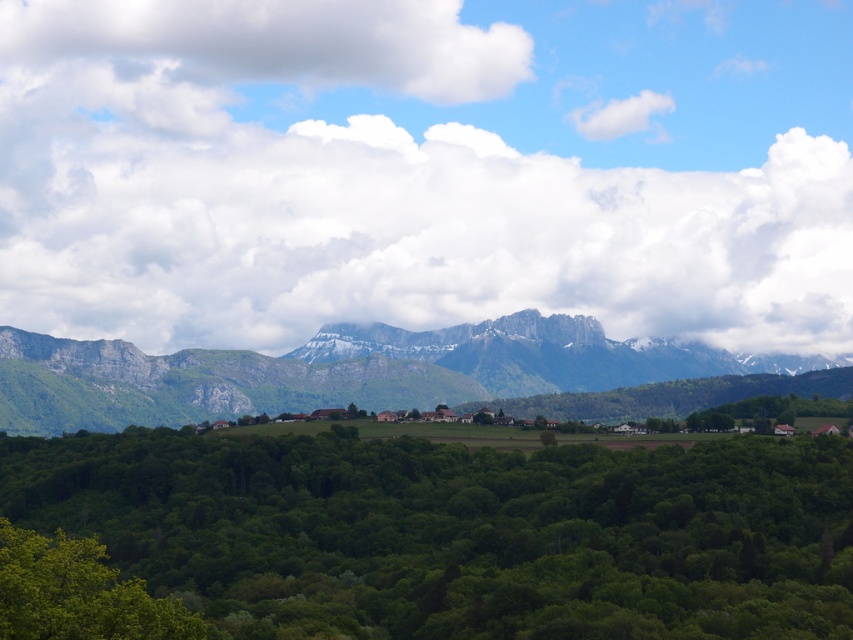
Question: Which of these objects is positioned farthest from the white fluffy cloud at upper left?

Choices:
 (A) green leafy tree at center
 (B) green leafy trees at center

Answer: (A)

Question: Is green rock mountain range at center to the left of white fluffy cloud at upper left from the viewer's perspective?

Choices:
 (A) yes
 (B) no

Answer: (B)

Question: Estimate the real-world distances between objects in this image. Which object is closer to the white fluffy cloud at upper left?

Choices:
 (A) green leafy tree at center
 (B) green leafy trees at center
 (C) green rock mountain range at center
 (D) green leafy tree at lower left

Answer: (C)

Question: Which point is closer to the camera taking this photo?

Choices:
 (A) (709, 352)
 (B) (207, 488)
 (C) (775, 211)
 (D) (300, 68)

Answer: (B)

Question: Is green leafy trees at center smaller than white fluffy cloud at upper left?

Choices:
 (A) no
 (B) yes

Answer: (A)

Question: Is green leafy trees at center behind green leafy tree at lower left?

Choices:
 (A) no
 (B) yes

Answer: (A)